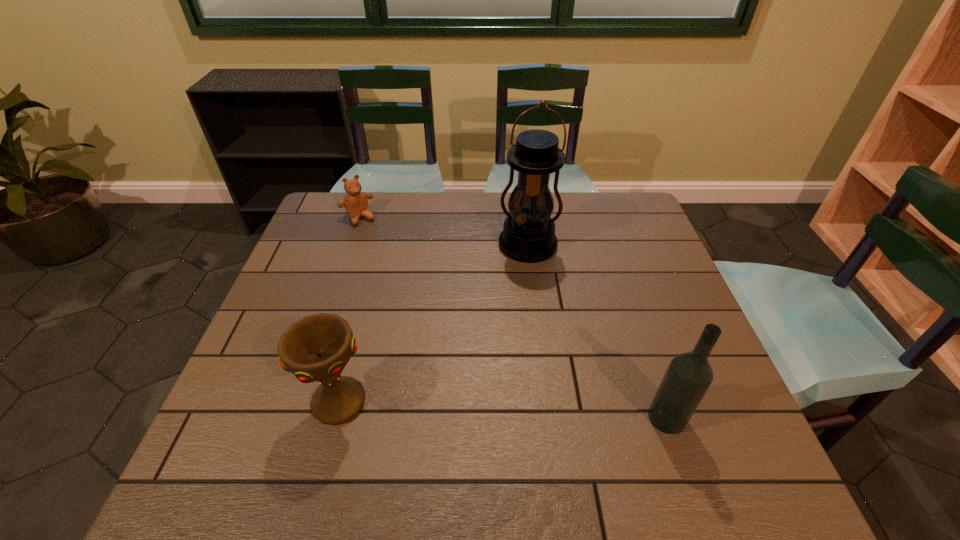
Identify the location of object situated at the far left corner. The height and width of the screenshot is (540, 960). (355, 202).

Identify the location of object at the near right corner. The width and height of the screenshot is (960, 540). (689, 375).

This screenshot has width=960, height=540. Find the location of `vacant region at the far edge of the desktop`. vacant region at the far edge of the desktop is located at coordinates (457, 213).

At what (x,y) coordinates should I click in order to perform the action: click on free space at the near edge. Please return your answer as a coordinate pair (x, y). Looking at the image, I should click on (403, 416).

Find the location of a particular element. free space at the left edge is located at coordinates (260, 363).

In the image, there is a desktop. Find the location of `vacant space at the right edge`. vacant space at the right edge is located at coordinates (650, 363).

In the image, there is a desktop. Where is `free space at the far left corner`? The width and height of the screenshot is (960, 540). free space at the far left corner is located at coordinates (340, 233).

Where is `free point at the far right corner`? The height and width of the screenshot is (540, 960). free point at the far right corner is located at coordinates (630, 221).

Identify the location of free space between the chalice and the teddy bear. (349, 310).

You are a GUI agent. You are given a task and a screenshot of the screen. Output one action in this format:
    pyautogui.click(x=<x>, y=<y>)
    Task: Click on the unoccupied area between the second shortest object and the teddy bear
    The image size is (960, 540).
    Given the screenshot: What is the action you would take?
    pyautogui.click(x=349, y=310)